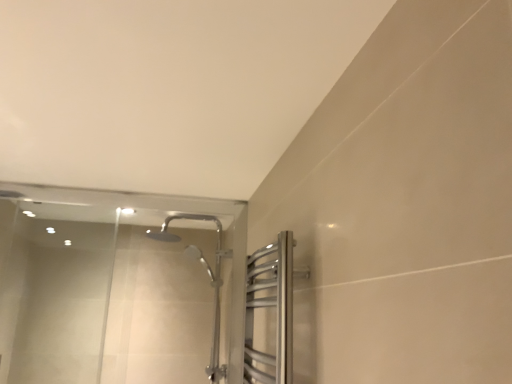
Where is `satin nickel towel rack at upper right`? satin nickel towel rack at upper right is located at coordinates (271, 306).

Describe the element at coordinates (271, 306) in the screenshot. I see `satin nickel towel rack at upper right` at that location.

In the scene shown: Measure the distance between point (4,371) and camera.

Point (4,371) is 7.64 feet away from camera.

The image size is (512, 384). In order to click on transparent glass shower door at upper left in this screenshot , I will do `click(116, 287)`.

Describe the element at coordinates (116, 287) in the screenshot. I see `transparent glass shower door at upper left` at that location.

Locate an element on the screen. satin nickel towel rack at upper right is located at coordinates (271, 306).

Does transparent glass shower door at upper left appear on the left side of satin nickel towel rack at upper right?

Indeed, transparent glass shower door at upper left is positioned on the left side of satin nickel towel rack at upper right.

Is the depth of transparent glass shower door at upper left less than that of satin nickel towel rack at upper right?

That is False.

Does point (3, 338) come farther from viewer compared to point (272, 245)?

Yes.

From the image's perspective, is transparent glass shower door at upper left over satin nickel towel rack at upper right?

No, from the image's perspective, transparent glass shower door at upper left is not over satin nickel towel rack at upper right.

From a real-world perspective, who is located lower, transparent glass shower door at upper left or satin nickel towel rack at upper right?

satin nickel towel rack at upper right.

Is transparent glass shower door at upper left wider than satin nickel towel rack at upper right?

No.

Based on the photo, between transparent glass shower door at upper left and satin nickel towel rack at upper right, which one has more height?

transparent glass shower door at upper left.

In terms of size, does transparent glass shower door at upper left appear bigger or smaller than satin nickel towel rack at upper right?

transparent glass shower door at upper left is bigger than satin nickel towel rack at upper right.

Is transparent glass shower door at upper left surrounding satin nickel towel rack at upper right?

No, satin nickel towel rack at upper right is not a part of transparent glass shower door at upper left.

Does transparent glass shower door at upper left touch satin nickel towel rack at upper right?

transparent glass shower door at upper left is not next to satin nickel towel rack at upper right, and they're not touching.

In the scene shown: Is transparent glass shower door at upper left positioned with its back to satin nickel towel rack at upper right?

That's not correct — transparent glass shower door at upper left is not looking away from satin nickel towel rack at upper right.

What's the angular difference between transparent glass shower door at upper left and satin nickel towel rack at upper right's facing directions?

transparent glass shower door at upper left and satin nickel towel rack at upper right are facing 90.4 degrees away from each other.

Where is `glass door that is below the satin nickel towel rack at upper right (from the image's perspective)`? Image resolution: width=512 pixels, height=384 pixels. glass door that is below the satin nickel towel rack at upper right (from the image's perspective) is located at coordinates (116, 287).

Does satin nickel towel rack at upper right appear on the left side of transparent glass shower door at upper left?

Incorrect, satin nickel towel rack at upper right is not on the left side of transparent glass shower door at upper left.

Considering the relative positions of satin nickel towel rack at upper right and transparent glass shower door at upper left in the image provided, is satin nickel towel rack at upper right in front of transparent glass shower door at upper left?

Yes, it is in front of transparent glass shower door at upper left.

Which is in front, point (285, 383) or point (85, 236)?

Point (285, 383)

From the image's perspective, who appears lower, satin nickel towel rack at upper right or transparent glass shower door at upper left?

transparent glass shower door at upper left, from the image's perspective.

From a real-world perspective, is satin nickel towel rack at upper right below transparent glass shower door at upper left?

Yes, from a real-world perspective, satin nickel towel rack at upper right is under transparent glass shower door at upper left.

Considering the sizes of objects satin nickel towel rack at upper right and transparent glass shower door at upper left in the image provided, who is wider, satin nickel towel rack at upper right or transparent glass shower door at upper left?

With larger width is satin nickel towel rack at upper right.

Does satin nickel towel rack at upper right have a greater height compared to transparent glass shower door at upper left?

Incorrect, the height of satin nickel towel rack at upper right is not larger of that of transparent glass shower door at upper left.

Does satin nickel towel rack at upper right have a smaller size compared to transparent glass shower door at upper left?

Yes.

Is satin nickel towel rack at upper right not inside transparent glass shower door at upper left?

Yes, satin nickel towel rack at upper right is outside of transparent glass shower door at upper left.

Is satin nickel towel rack at upper right next to transparent glass shower door at upper left and touching it?

No.

Could you tell me if satin nickel towel rack at upper right is facing transparent glass shower door at upper left?

No, satin nickel towel rack at upper right does not turn towards transparent glass shower door at upper left.

What's the angular difference between satin nickel towel rack at upper right and transparent glass shower door at upper left's facing directions?

satin nickel towel rack at upper right and transparent glass shower door at upper left are facing 90.4 degrees away from each other.

This screenshot has height=384, width=512. I want to click on glass door that is on the left side of satin nickel towel rack at upper right, so click(x=116, y=287).

You are a GUI agent. You are given a task and a screenshot of the screen. Output one action in this format:
    pyautogui.click(x=<x>, y=<y>)
    Task: Click on the glass door behind the satin nickel towel rack at upper right
    
    Given the screenshot: What is the action you would take?
    click(x=116, y=287)

What are the coordinates of `screen door on the right side of transparent glass shower door at upper left` in the screenshot? It's located at (271, 306).